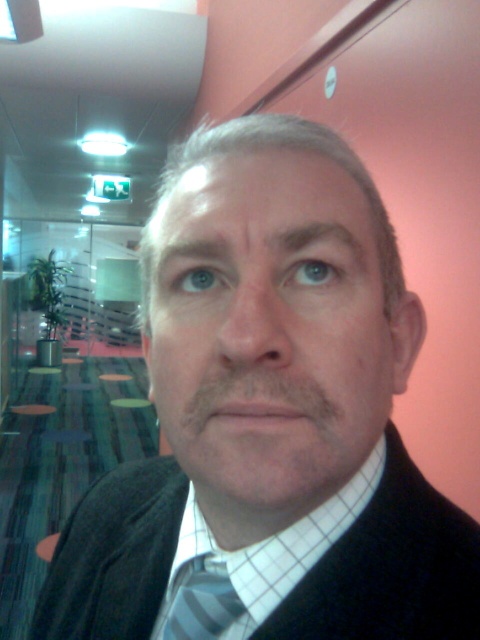
You are a photographer setting up a shoot in this scene. You need to ensure that the matte black face at center is visible above the white checkered dress shirt at center in the final image. Based on the scene description, is this arrangement already achievable?

Yes, the matte black face at center is already positioned above the white checkered dress shirt at center, so the arrangement is achievable without adjustments.

You are an interior designer analyzing the placement of items in the image. The white checkered dress shirt at center is positioned at coordinates 0.880 on the x and 0.529 on the y axis. If the room has a coordinate system where the bottom left corner is the origin, can you determine if the shirt is closer to the top or bottom of the image?

The white checkered dress shirt at center is located at point 0.880 on the x and 0.529 on the y axis. Since the y coordinate is 0.529, which is just above the halfway point of the image, the shirt is closer to the bottom of the image.

Consider the image. You are a photographer adjusting the lighting in the scene. You need to ensure that both the white checkered dress shirt at center and the striped fabric tie at center are well lit. Since the lighting is dim, where should you place the light source relative to the subject?

Since the white checkered dress shirt at center is to the right of the striped fabric tie at center, placing the light source to the right side of the subject would help illuminate both areas effectively.